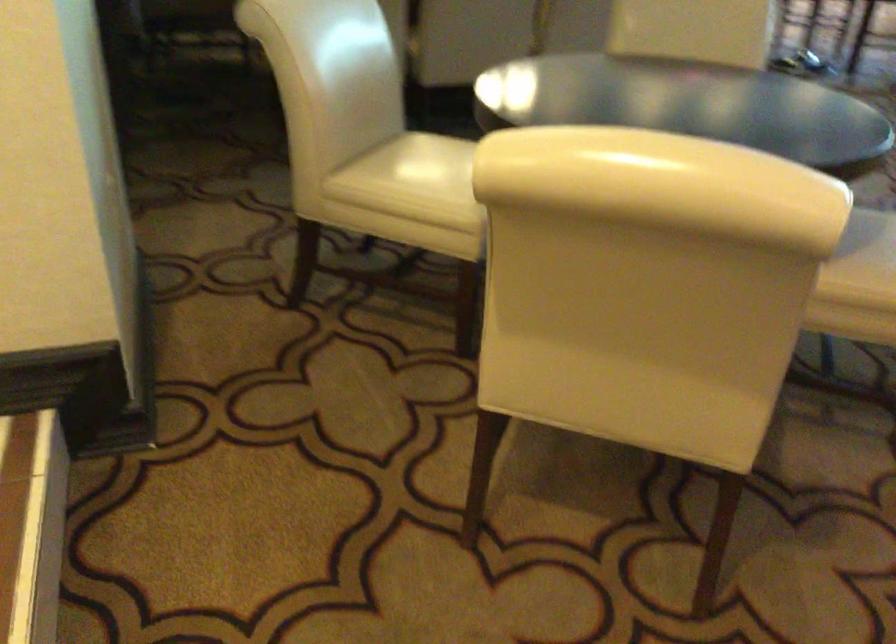
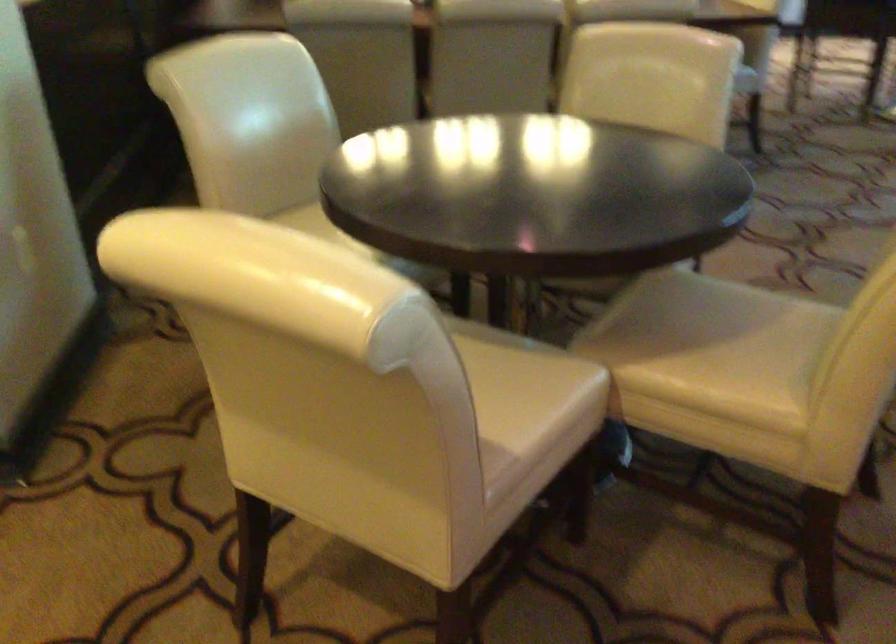
Question: The images are taken continuously from a first-person perspective. In which direction are you moving?

Choices:
 (A) Left
 (B) Right
 (C) Forward
 (D) Backward

Answer: (B)